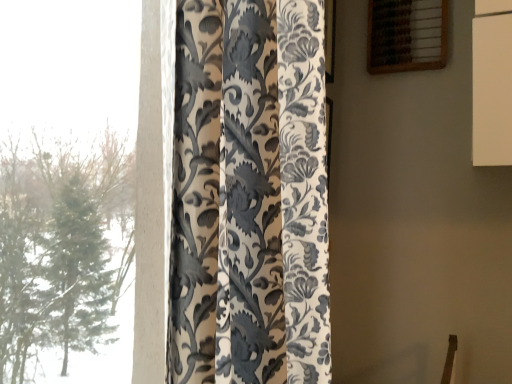
What do you see at coordinates (406, 35) in the screenshot?
I see `wooden abacus at upper right` at bounding box center [406, 35].

The height and width of the screenshot is (384, 512). Find the location of `wooden abacus at upper right`. wooden abacus at upper right is located at coordinates (406, 35).

Describe the element at coordinates (249, 195) in the screenshot. The width and height of the screenshot is (512, 384). I see `silky floral-patterned curtain at left` at that location.

Where is `silky floral-patterned curtain at left`? silky floral-patterned curtain at left is located at coordinates (249, 195).

Find the location of a particular element. This screenshot has height=384, width=512. wooden abacus at upper right is located at coordinates (406, 35).

Is silky floral-patterned curtain at left to the left or to the right of wooden abacus at upper right in the image?

Based on their positions, silky floral-patterned curtain at left is located to the left of wooden abacus at upper right.

Is silky floral-patterned curtain at left in front of or behind wooden abacus at upper right in the image?

silky floral-patterned curtain at left is in front of wooden abacus at upper right.

Does point (175, 340) come in front of point (403, 33)?

Yes, point (175, 340) is in front of point (403, 33).

From the image's perspective, is silky floral-patterned curtain at left positioned above or below wooden abacus at upper right?

From the image's perspective, silky floral-patterned curtain at left appears below wooden abacus at upper right.

From a real-world perspective, does silky floral-patterned curtain at left sit lower than wooden abacus at upper right?

Yes, from a real-world perspective, silky floral-patterned curtain at left is beneath wooden abacus at upper right.

Looking at their sizes, would you say silky floral-patterned curtain at left is wider or thinner than wooden abacus at upper right?

In the image, silky floral-patterned curtain at left appears to be wider than wooden abacus at upper right.

Does silky floral-patterned curtain at left have a greater height compared to wooden abacus at upper right?

Yes.

Is silky floral-patterned curtain at left bigger or smaller than wooden abacus at upper right?

In the image, silky floral-patterned curtain at left appears to be larger than wooden abacus at upper right.

Is silky floral-patterned curtain at left inside or outside of wooden abacus at upper right?

silky floral-patterned curtain at left is not enclosed by wooden abacus at upper right.

Does silky floral-patterned curtain at left touch wooden abacus at upper right?

No, silky floral-patterned curtain at left is not with wooden abacus at upper right.

Is silky floral-patterned curtain at left oriented away from wooden abacus at upper right?

No, silky floral-patterned curtain at left's orientation is not away from wooden abacus at upper right.

What's the angular difference between silky floral-patterned curtain at left and wooden abacus at upper right's facing directions?

silky floral-patterned curtain at left and wooden abacus at upper right are facing 85.5 degrees away from each other.

Measure the distance between silky floral-patterned curtain at left and wooden abacus at upper right.

silky floral-patterned curtain at left and wooden abacus at upper right are 1.12 meters apart from each other.

Where is `curtain located in front of the wooden abacus at upper right`? The height and width of the screenshot is (384, 512). curtain located in front of the wooden abacus at upper right is located at coordinates (249, 195).

Is wooden abacus at upper right to the left of silky floral-patterned curtain at left from the viewer's perspective?

In fact, wooden abacus at upper right is to the right of silky floral-patterned curtain at left.

Is wooden abacus at upper right further to camera compared to silky floral-patterned curtain at left?

Yes, it is behind silky floral-patterned curtain at left.

Consider the image. Which point is more forward, (433, 16) or (234, 183)?

The point (234, 183) is in front.

From the image's perspective, which one is positioned higher, wooden abacus at upper right or silky floral-patterned curtain at left?

wooden abacus at upper right appears higher in the image.

From a real-world perspective, is wooden abacus at upper right physically located above or below silky floral-patterned curtain at left?

From a real-world perspective, wooden abacus at upper right is physically above silky floral-patterned curtain at left.

Which object is thinner, wooden abacus at upper right or silky floral-patterned curtain at left?

With smaller width is wooden abacus at upper right.

Who is shorter, wooden abacus at upper right or silky floral-patterned curtain at left?

Standing shorter between the two is wooden abacus at upper right.

Based on their sizes in the image, would you say wooden abacus at upper right is bigger or smaller than silky floral-patterned curtain at left?

Considering their sizes, wooden abacus at upper right takes up less space than silky floral-patterned curtain at left.

Would you say silky floral-patterned curtain at left is part of wooden abacus at upper right's contents?

That's incorrect, silky floral-patterned curtain at left is not inside wooden abacus at upper right.

Does wooden abacus at upper right touch silky floral-patterned curtain at left?

wooden abacus at upper right and silky floral-patterned curtain at left are not in contact.

Consider the image. Could you tell me if wooden abacus at upper right is facing silky floral-patterned curtain at left?

No.

You are a GUI agent. You are given a task and a screenshot of the screen. Output one action in this format:
    pyautogui.click(x=<x>, y=<y>)
    Task: Click on the window that is above the silky floral-patterned curtain at left (from a real-world perspective)
    
    Given the screenshot: What is the action you would take?
    pyautogui.click(x=406, y=35)

At what (x,y) coordinates should I click in order to perform the action: click on window that is on the right side of silky floral-patterned curtain at left. Please return your answer as a coordinate pair (x, y). The width and height of the screenshot is (512, 384). Looking at the image, I should click on (406, 35).

This screenshot has width=512, height=384. I want to click on curtain located on the left of wooden abacus at upper right, so pos(249,195).